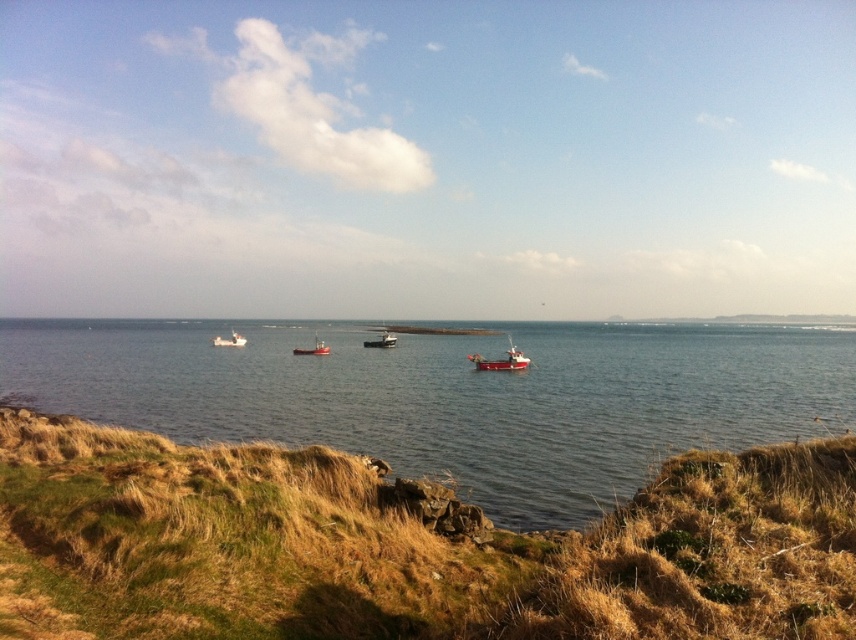
You are a photographer planning to capture a wide shot of the coastal scene. You want to ensure that both the dry grass at lower left and the red matte fishing boat at lower center are clearly visible in the frame. Based on their sizes, which object might occupy more horizontal space in the photo?

The dry grass at lower left might be wider than the red matte fishing boat at lower center, so it could occupy more horizontal space in the photo.